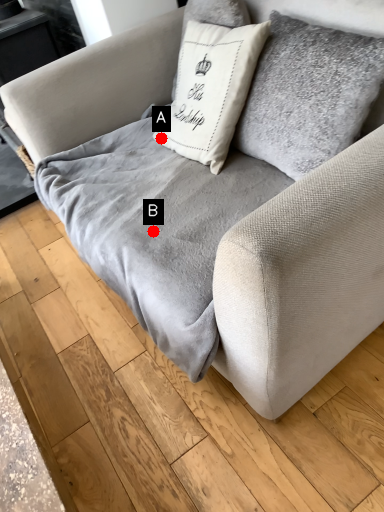
Question: Two points are circled on the image, labeled by A and B beside each circle. Which point is farther to the camera?

Choices:
 (A) A is further
 (B) B is further

Answer: (A)